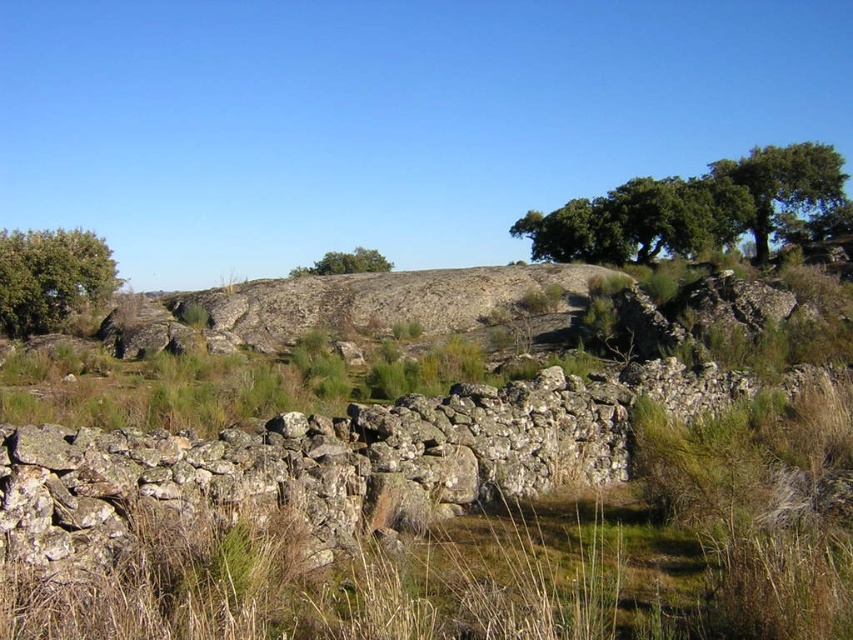
Question: Which point is farther to the camera?

Choices:
 (A) weathered stone wall at center
 (B) green leafy tree at center

Answer: (B)

Question: Is green leafy tree at left to the right of green leafy tree at center from the viewer's perspective?

Choices:
 (A) yes
 (B) no

Answer: (B)

Question: Is green leafy tree at upper right thinner than green leafy tree at center?

Choices:
 (A) yes
 (B) no

Answer: (B)

Question: Estimate the real-world distances between objects in this image. Which object is farther from the green leafy tree at upper right?

Choices:
 (A) green leafy tree at center
 (B) weathered stone wall at center

Answer: (B)

Question: Which object is the farthest from the green leafy tree at upper right?

Choices:
 (A) weathered stone wall at center
 (B) green leafy tree at center

Answer: (A)

Question: Is weathered stone wall at center wider than green leafy tree at left?

Choices:
 (A) no
 (B) yes

Answer: (A)